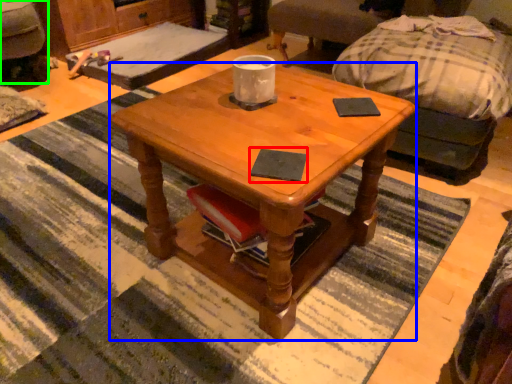
Question: Which object is the closest to the pad (highlighted by a red box)? Choose among these: coffee table (highlighted by a blue box) or swivel chair (highlighted by a green box).

Choices:
 (A) coffee table
 (B) swivel chair

Answer: (A)